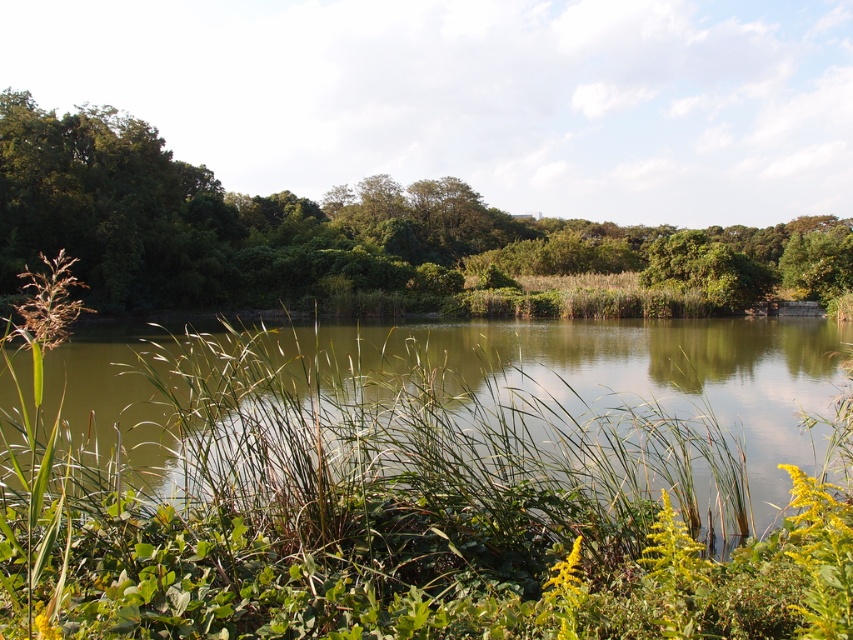
Question: Is green grassy river at center in front of green leafy tree at center?

Choices:
 (A) no
 (B) yes

Answer: (B)

Question: Does green grassy river at center appear under green leafy tree at center?

Choices:
 (A) yes
 (B) no

Answer: (A)

Question: Which object is farther from the camera taking this photo?

Choices:
 (A) green leafy tree at center
 (B) green grassy river at center

Answer: (A)

Question: Is green grassy river at center to the right of green leafy tree at center from the viewer's perspective?

Choices:
 (A) no
 (B) yes

Answer: (A)